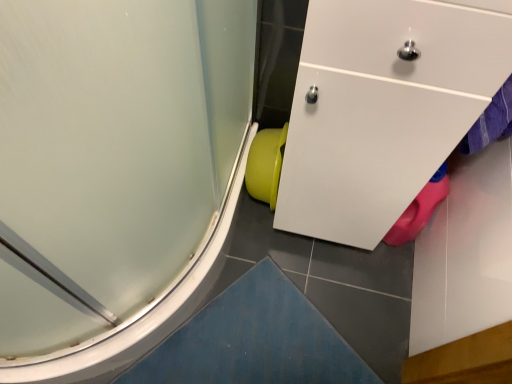
You are a GUI agent. You are given a task and a screenshot of the screen. Output one action in this format:
    pyautogui.click(x=<x>, y=<y>)
    Task: Click on the frosted glass shower door at lower left
    
    Given the screenshot: What is the action you would take?
    pyautogui.click(x=114, y=170)

What do you see at coordinates (114, 170) in the screenshot?
I see `frosted glass shower door at lower left` at bounding box center [114, 170].

The width and height of the screenshot is (512, 384). Describe the element at coordinates (266, 164) in the screenshot. I see `matte plastic toilet bowl at lower center` at that location.

Based on the photo, measure the distance between point (263, 180) and camera.

Point (263, 180) and camera are 1.24 meters apart.

The height and width of the screenshot is (384, 512). I want to click on matte plastic toilet bowl at lower center, so click(x=266, y=164).

The image size is (512, 384). I want to click on frosted glass shower door at lower left, so click(114, 170).

Is matte plastic toilet bowl at lower center to the right of frosted glass shower door at lower left from the viewer's perspective?

Indeed, matte plastic toilet bowl at lower center is positioned on the right side of frosted glass shower door at lower left.

Consider the image. Is matte plastic toilet bowl at lower center positioned before frosted glass shower door at lower left?

No, it is behind frosted glass shower door at lower left.

Is point (245, 176) closer or farther from the camera than point (54, 328)?

Point (245, 176).

From the image's perspective, is matte plastic toilet bowl at lower center on frosted glass shower door at lower left?

No, from the image's perspective, matte plastic toilet bowl at lower center is not on top of frosted glass shower door at lower left.

From a real-world perspective, is matte plastic toilet bowl at lower center above or below frosted glass shower door at lower left?

matte plastic toilet bowl at lower center is situated lower than frosted glass shower door at lower left in the real world.

Looking at their sizes, would you say matte plastic toilet bowl at lower center is wider or thinner than frosted glass shower door at lower left?

matte plastic toilet bowl at lower center is thinner than frosted glass shower door at lower left.

Considering the sizes of matte plastic toilet bowl at lower center and frosted glass shower door at lower left in the image, is matte plastic toilet bowl at lower center taller or shorter than frosted glass shower door at lower left?

In the image, matte plastic toilet bowl at lower center appears to be shorter than frosted glass shower door at lower left.

Does matte plastic toilet bowl at lower center have a larger size compared to frosted glass shower door at lower left?

Incorrect, matte plastic toilet bowl at lower center is not larger than frosted glass shower door at lower left.

Based on the photo, is matte plastic toilet bowl at lower center inside the boundaries of frosted glass shower door at lower left, or outside?

The correct answer is: outside.

Is matte plastic toilet bowl at lower center far from frosted glass shower door at lower left?

No, matte plastic toilet bowl at lower center is not far from frosted glass shower door at lower left.

Is matte plastic toilet bowl at lower center facing towards frosted glass shower door at lower left?

No, matte plastic toilet bowl at lower center does not turn towards frosted glass shower door at lower left.

Measure the distance between matte plastic toilet bowl at lower center and frosted glass shower door at lower left.

matte plastic toilet bowl at lower center and frosted glass shower door at lower left are 17.39 inches apart from each other.

At what (x,y) coordinates should I click in order to perform the action: click on shower door in front of the matte plastic toilet bowl at lower center. Please return your answer as a coordinate pair (x, y). Image resolution: width=512 pixels, height=384 pixels. Looking at the image, I should click on (114, 170).

Between frosted glass shower door at lower left and matte plastic toilet bowl at lower center, which one appears on the left side from the viewer's perspective?

Positioned to the left is frosted glass shower door at lower left.

Which object is further away from the camera taking this photo, frosted glass shower door at lower left or matte plastic toilet bowl at lower center?

matte plastic toilet bowl at lower center is behind.

Considering the positions of points (86, 170) and (261, 133), is point (86, 170) farther from camera compared to point (261, 133)?

No, it is in front of (261, 133).

From the image's perspective, which is below, frosted glass shower door at lower left or matte plastic toilet bowl at lower center?

matte plastic toilet bowl at lower center appears lower in the image.

From a real-world perspective, between frosted glass shower door at lower left and matte plastic toilet bowl at lower center, who is vertically lower?

In real-world perspective, matte plastic toilet bowl at lower center is lower.

Which of these two, frosted glass shower door at lower left or matte plastic toilet bowl at lower center, is thinner?

Thinner between the two is matte plastic toilet bowl at lower center.

Considering the sizes of objects frosted glass shower door at lower left and matte plastic toilet bowl at lower center in the image provided, who is shorter, frosted glass shower door at lower left or matte plastic toilet bowl at lower center?

With less height is matte plastic toilet bowl at lower center.

Considering the sizes of frosted glass shower door at lower left and matte plastic toilet bowl at lower center in the image, is frosted glass shower door at lower left bigger or smaller than matte plastic toilet bowl at lower center?

Considering their sizes, frosted glass shower door at lower left takes up more space than matte plastic toilet bowl at lower center.

Would you say frosted glass shower door at lower left is inside or outside matte plastic toilet bowl at lower center?

The correct answer is: outside.

Is frosted glass shower door at lower left not near matte plastic toilet bowl at lower center?

frosted glass shower door at lower left is near matte plastic toilet bowl at lower center, not far away.

Is frosted glass shower door at lower left positioned with its back to matte plastic toilet bowl at lower center?

No.

Can you tell me how much frosted glass shower door at lower left and matte plastic toilet bowl at lower center differ in facing direction?

The angular difference between frosted glass shower door at lower left and matte plastic toilet bowl at lower center is 91.9 degrees.

Image resolution: width=512 pixels, height=384 pixels. Find the location of `shower door above the matte plastic toilet bowl at lower center (from the image's perspective)`. shower door above the matte plastic toilet bowl at lower center (from the image's perspective) is located at coordinates (114, 170).

Where is `toilet bowl below the frosted glass shower door at lower left (from the image's perspective)`? This screenshot has height=384, width=512. toilet bowl below the frosted glass shower door at lower left (from the image's perspective) is located at coordinates (266, 164).

Locate an element on the screen. shower door above the matte plastic toilet bowl at lower center (from a real-world perspective) is located at coordinates (114, 170).